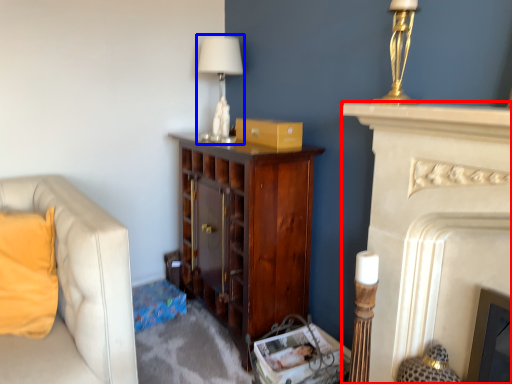
Question: Which of the following is the closest to the observer, fireplace (highlighted by a red box) or table lamp (highlighted by a blue box)?

Choices:
 (A) fireplace
 (B) table lamp

Answer: (A)